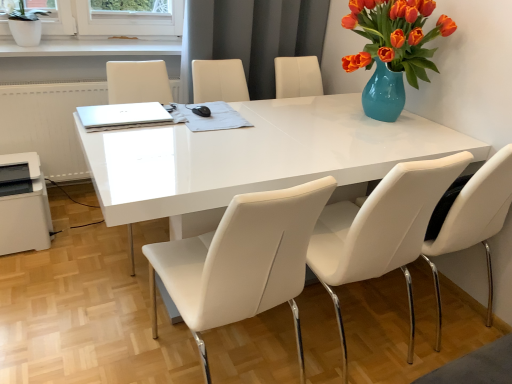
Locate an element on the screen. This screenshot has height=384, width=512. empty space that is ontop of white plastic printer at lower left is located at coordinates (14, 162).